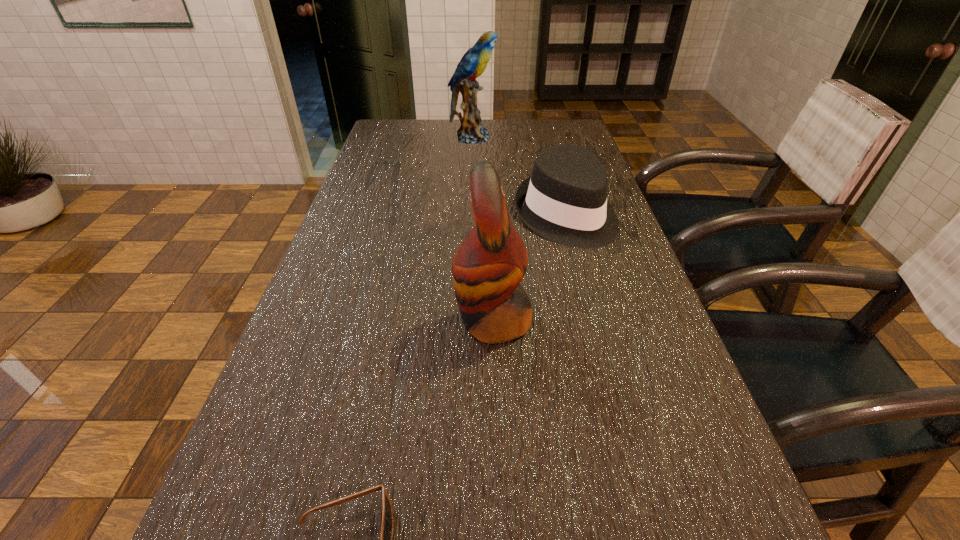
Locate an element on the screen. The image size is (960, 540). object at the right edge is located at coordinates (564, 200).

You are a GUI agent. You are given a task and a screenshot of the screen. Output one action in this format:
    pyautogui.click(x=<x>, y=<y>)
    Task: Click on the vacant area at the left edge of the desktop
    The image size is (960, 540).
    Given the screenshot: What is the action you would take?
    pyautogui.click(x=352, y=191)

Find the location of `vacant space at the right edge of the desktop`. vacant space at the right edge of the desktop is located at coordinates (676, 498).

This screenshot has height=540, width=960. In the image, there is a desktop. Identify the location of free space at the far right corner. (575, 137).

Locate an element on the screen. free area in between the nearer parrot and the third nearest object is located at coordinates (529, 268).

The height and width of the screenshot is (540, 960). In order to click on vacant space that's between the farthest object and the third tallest object in this screenshot , I will do `click(518, 177)`.

I want to click on empty space that is in between the farther parrot and the third nearest object, so click(518, 177).

Image resolution: width=960 pixels, height=540 pixels. I want to click on object that can be found as the second closest to the leftmost object, so click(564, 200).

The width and height of the screenshot is (960, 540). Identify the location of object that stands as the third closest to the farther parrot. (387, 527).

The width and height of the screenshot is (960, 540). Find the location of `free spot that satisfies the following two spatial constraints: 1. on the face of the farther parrot; 2. on the back side of the third nearest object`. free spot that satisfies the following two spatial constraints: 1. on the face of the farther parrot; 2. on the back side of the third nearest object is located at coordinates (469, 215).